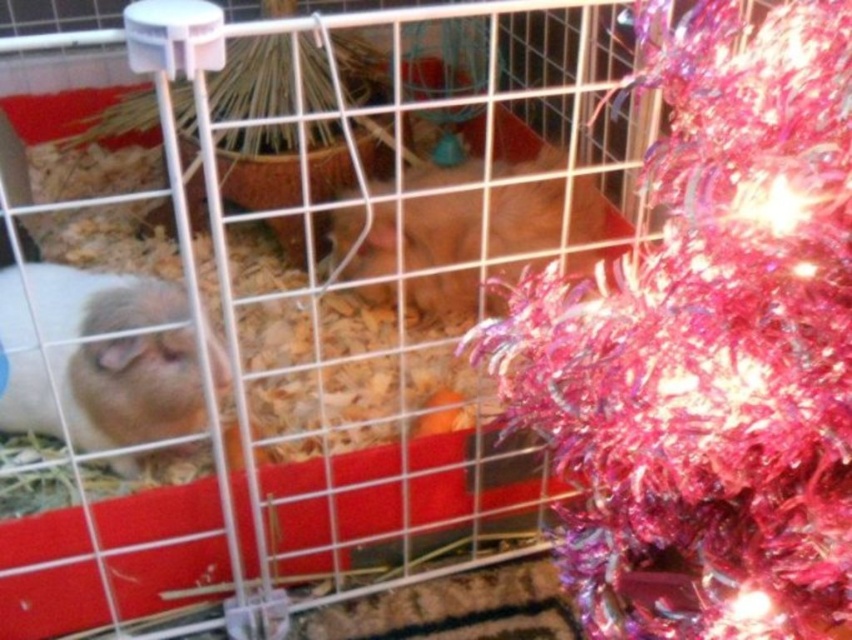
Does shiny pink tinsel at center have a larger size compared to fuzzy brown hamster at center?

Indeed, shiny pink tinsel at center has a larger size compared to fuzzy brown hamster at center.

Is point (776, 308) in front of point (458, 221)?

Yes.

Identify the location of shiny pink tinsel at center. (709, 348).

Who is positioned more to the right, shiny pink tinsel at center or fuzzy beige hamster at left?

shiny pink tinsel at center

From the picture: Between shiny pink tinsel at center and fuzzy beige hamster at left, which one is positioned lower?

Positioned lower is fuzzy beige hamster at left.

Is point (752, 449) positioned behind point (50, 333)?

No, (752, 449) is closer to viewer.

At what (x,y) coordinates should I click in order to perform the action: click on shiny pink tinsel at center. Please return your answer as a coordinate pair (x, y). This screenshot has width=852, height=640. Looking at the image, I should click on (709, 348).

Looking at this image, which is more to the left, fuzzy beige hamster at left or fuzzy brown hamster at center?

fuzzy beige hamster at left

Which of these two, fuzzy beige hamster at left or fuzzy brown hamster at center, stands taller?

fuzzy brown hamster at center is taller.

Does point (157, 342) come behind point (407, 305)?

That is False.

The width and height of the screenshot is (852, 640). Identify the location of fuzzy beige hamster at left. (130, 388).